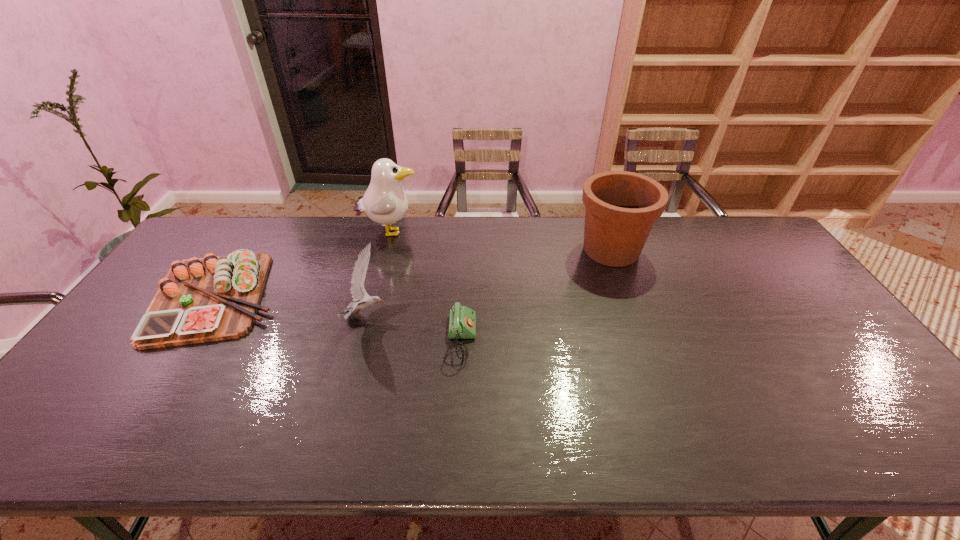
I want to click on blank area at the far edge, so click(x=262, y=235).

Locate an element on the screen. vacant space at the near edge of the desktop is located at coordinates pos(685,425).

You are a GUI agent. You are given a task and a screenshot of the screen. Output one action in this format:
    pyautogui.click(x=<x>, y=<y>)
    Task: Click on the vacant space at the left edge of the desktop
    
    Given the screenshot: What is the action you would take?
    pyautogui.click(x=114, y=387)

I want to click on vacant region at the right edge of the desktop, so click(x=789, y=303).

In the image, there is a desktop. Identify the location of free space at the far left corner. (182, 254).

You are a GUI agent. You are given a task and a screenshot of the screen. Output one action in this format:
    pyautogui.click(x=<x>, y=<y>)
    Task: Click on the vacant space at the near right corner of the desktop
    
    Given the screenshot: What is the action you would take?
    pyautogui.click(x=938, y=453)

Image resolution: width=960 pixels, height=540 pixels. Find the location of `vacant space that's between the leftmost object and the taller gull`. vacant space that's between the leftmost object and the taller gull is located at coordinates click(302, 265).

At what (x,y) coordinates should I click in order to perform the action: click on free space between the fourth shortest object and the nearer gull. Please return your answer as a coordinate pair (x, y). This screenshot has width=960, height=540. Looking at the image, I should click on (489, 283).

Locate an element on the screen. free spot between the shortest object and the second tallest object is located at coordinates pyautogui.click(x=536, y=295).

In order to click on free spot between the second shortest object and the taller gull in this screenshot , I will do `click(302, 265)`.